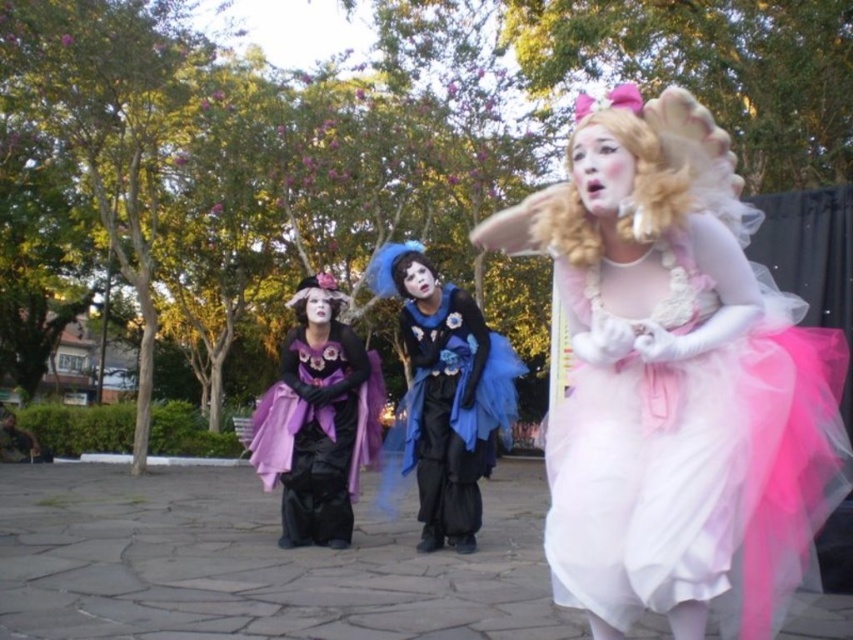
Based on the photo, does matte white dress at center appear on the right side of matte purple coat at center?

Yes, matte white dress at center is to the right of matte purple coat at center.

Is point (566, 220) behind point (379, 403)?

That is False.

Find the location of a particular element. The image size is (853, 640). matte white dress at center is located at coordinates (675, 380).

Is blonde curly wig at center below blue tulle wig at center?

No, blonde curly wig at center is not below blue tulle wig at center.

Does point (579, 209) come behind point (405, 296)?

That is False.

Locate an element on the screen. blonde curly wig at center is located at coordinates (630, 189).

Image resolution: width=853 pixels, height=640 pixels. I want to click on blonde curly wig at center, so click(630, 189).

Can you confirm if matte white dress at center is wider than matte blue tulle dress at center?

No.

Which is behind, point (688, 465) or point (463, 422)?

Point (463, 422)

Is point (688, 600) farther from viewer compared to point (433, 538)?

No, (688, 600) is in front of (433, 538).

Locate an element on the screen. matte white dress at center is located at coordinates (675, 380).